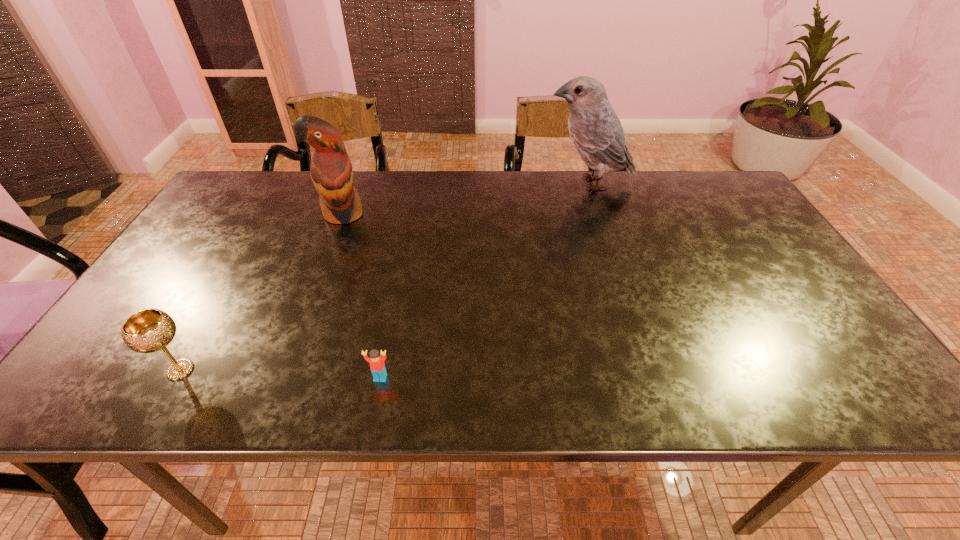
This screenshot has height=540, width=960. Identify the location of the farther parrot. (596, 132).

Identify the location of the right parrot. This screenshot has height=540, width=960. (596, 132).

At what (x,y) coordinates should I click in order to perform the action: click on the left parrot. Please return your answer as a coordinate pair (x, y). The height and width of the screenshot is (540, 960). Looking at the image, I should click on (331, 171).

Locate an element on the screen. The image size is (960, 540). the nearer parrot is located at coordinates (331, 171).

You are a GUI agent. You are given a task and a screenshot of the screen. Output one action in this format:
    pyautogui.click(x=<x>, y=<y>)
    Task: Click on the leftmost object
    
    Given the screenshot: What is the action you would take?
    pyautogui.click(x=149, y=330)

The image size is (960, 540). Identify the location of the third tallest object. (149, 330).

At what (x,y) coordinates should I click in order to perform the action: click on the second object from right to left. Please return your answer as a coordinate pair (x, y). The width and height of the screenshot is (960, 540). Looking at the image, I should click on (377, 366).

The width and height of the screenshot is (960, 540). I want to click on Lego, so click(x=377, y=366).

Locate an element on the screen. This screenshot has height=540, width=960. vacant space located 0.250m on the front-facing side of the farthest object is located at coordinates (466, 183).

Image resolution: width=960 pixels, height=540 pixels. Identify the location of vacant space located on the front-facing side of the farthest object. (434, 183).